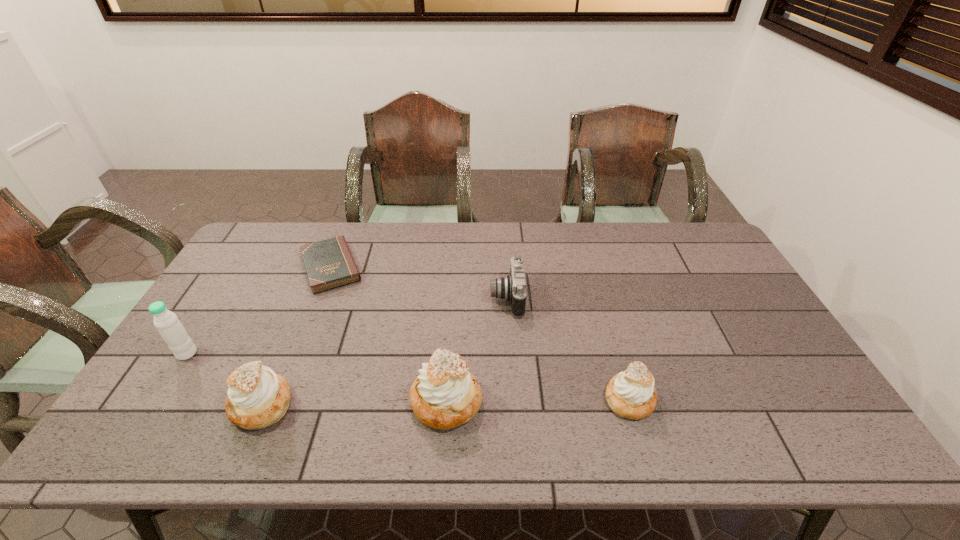
Identify the location of free region at the far left corner of the desktop. This screenshot has height=540, width=960. (279, 230).

At what (x,y) coordinates should I click in order to perform the action: click on empty space between the rightmost object and the camera. Please return your answer as a coordinate pair (x, y). The width and height of the screenshot is (960, 540). Looking at the image, I should click on (568, 348).

Locate an element on the screen. free point between the fifth object from left to right and the leftmost object is located at coordinates (347, 326).

Image resolution: width=960 pixels, height=540 pixels. What are the coordinates of `vacant space in between the shortest pastry and the Bible` in the screenshot? It's located at (480, 333).

Where is `free space between the leftmost pastry and the second pastry from left to right`? free space between the leftmost pastry and the second pastry from left to right is located at coordinates (354, 403).

Locate an element on the screen. The height and width of the screenshot is (540, 960). blank region between the second tallest pastry and the water bottle is located at coordinates (225, 379).

Find the location of `empty location between the leftmost pastry and the second pastry from left to right`. empty location between the leftmost pastry and the second pastry from left to right is located at coordinates (354, 403).

Locate an element on the screen. The width and height of the screenshot is (960, 540). vacant area that lies between the Bible and the camera is located at coordinates (419, 282).

At what (x,y) coordinates should I click in order to perform the action: click on vacant area that lies between the tallest object and the second shortest pastry. Please return your answer as a coordinate pair (x, y). This screenshot has width=960, height=540. Looking at the image, I should click on (225, 379).

The height and width of the screenshot is (540, 960). Identify the location of free spot between the camera and the Bible. (419, 282).